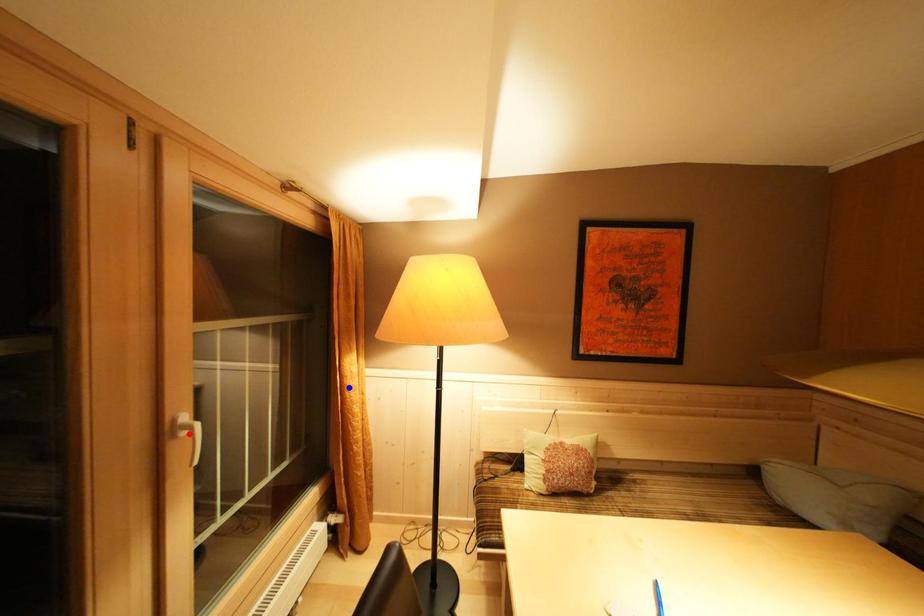
Question: Which of the two points in the image is closer to the camera?

Choices:
 (A) Blue point is closer.
 (B) Red point is closer.

Answer: (B)